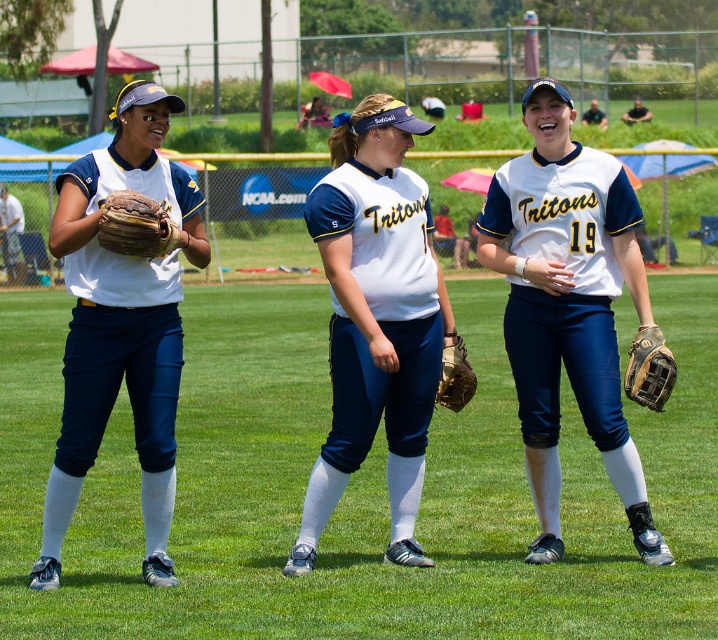
Is point (396, 522) positioned before point (447, 358)?

Yes, it is in front of point (447, 358).

Where is `white matte uniform at center`? This screenshot has width=718, height=640. white matte uniform at center is located at coordinates (376, 320).

Does point (416, 317) lie in front of point (643, 342)?

That is True.

In the scene shown: Who is more forward, (396, 145) or (628, 364)?

Point (396, 145) is in front.

Locate an element on the screen. Image resolution: width=718 pixels, height=640 pixels. white matte uniform at center is located at coordinates (376, 320).

Who is taller, brown leather glove at left or brown leather baseball glove at lower right?

brown leather baseball glove at lower right is taller.

Between point (141, 250) and point (651, 404), which one is positioned behind?

Positioned behind is point (651, 404).

This screenshot has width=718, height=640. Identify the location of brown leather glove at left. (135, 225).